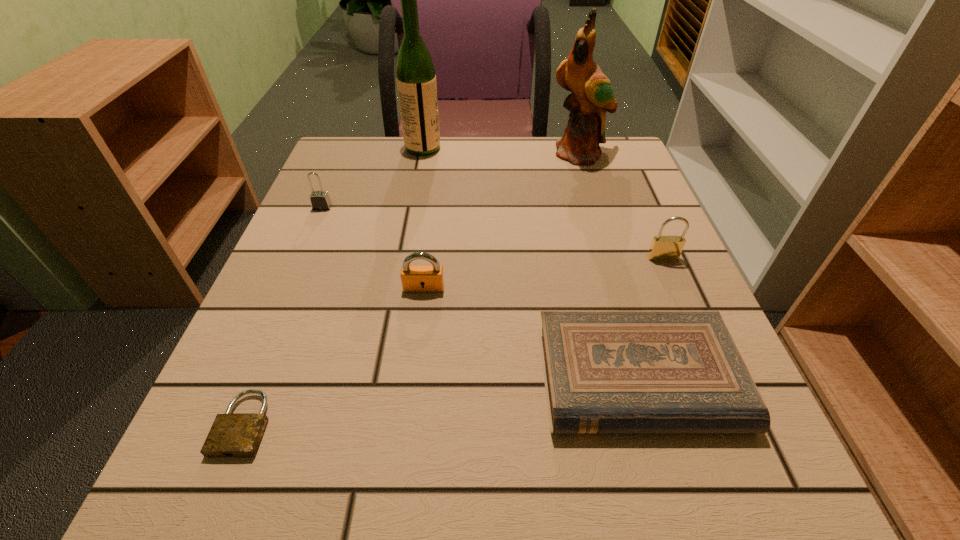
Locate an element on the screen. free space between the liquor and the parrot is located at coordinates (501, 151).

I want to click on free spot between the parrot and the liquor, so click(501, 151).

You are a GUI agent. You are given a task and a screenshot of the screen. Output one action in this format:
    pyautogui.click(x=<x>, y=<y>)
    Task: Click on the vacant area between the third farthest object and the nearest padlock
    This screenshot has width=960, height=540.
    Given the screenshot: What is the action you would take?
    pyautogui.click(x=283, y=315)

This screenshot has height=540, width=960. I want to click on vacant region between the parrot and the second farthest padlock, so click(x=621, y=206).

This screenshot has height=540, width=960. In order to click on free space between the third farthest padlock and the shortest object in this screenshot , I will do `click(334, 355)`.

This screenshot has width=960, height=540. Identify the location of free space between the third farthest object and the third farthest padlock. (373, 247).

You are a GUI agent. You are given a task and a screenshot of the screen. Output one action in this format:
    pyautogui.click(x=<x>, y=<y>)
    Task: Click on the unoccupied position between the third nearest object and the parrot
    This screenshot has width=960, height=540.
    Given the screenshot: What is the action you would take?
    pyautogui.click(x=502, y=221)

Identify the location of vacant area that lies between the liquor and the second nearest padlock. (423, 218).

Identify the location of empty location between the farthest padlock and the nearest padlock. This screenshot has height=540, width=960. (283, 315).

The image size is (960, 540). What are the coordinates of `vacant space in between the shortest padlock and the fifth farthest object` in the screenshot? It's located at (334, 355).